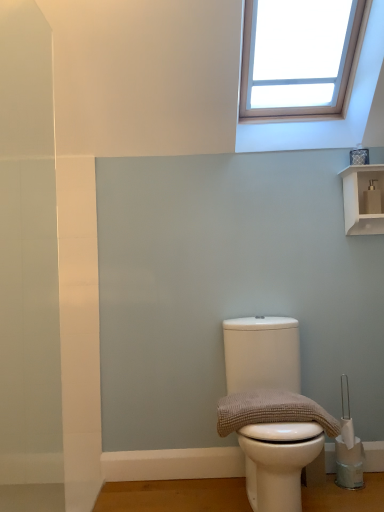
Question: Is white matte toilet at center in front of brown textured towel at center?

Choices:
 (A) no
 (B) yes

Answer: (B)

Question: Is white matte toilet at center not close to brown textured towel at center?

Choices:
 (A) no
 (B) yes

Answer: (A)

Question: From a real-world perspective, does white matte toilet at center stand above brown textured towel at center?

Choices:
 (A) no
 (B) yes

Answer: (A)

Question: Considering the relative sizes of white matte toilet at center and brown textured towel at center in the image provided, is white matte toilet at center thinner than brown textured towel at center?

Choices:
 (A) no
 (B) yes

Answer: (A)

Question: Is white matte toilet at center directly adjacent to brown textured towel at center?

Choices:
 (A) no
 (B) yes

Answer: (A)

Question: Considering the relative sizes of white matte toilet at center and brown textured towel at center in the image provided, is white matte toilet at center smaller than brown textured towel at center?

Choices:
 (A) yes
 (B) no

Answer: (B)

Question: From the image's perspective, would you say brown textured towel at center is shown under white matte toilet at center?

Choices:
 (A) no
 (B) yes

Answer: (A)

Question: Is brown textured towel at center not within white matte toilet at center?

Choices:
 (A) yes
 (B) no

Answer: (B)

Question: Does brown textured towel at center have a greater height compared to white matte toilet at center?

Choices:
 (A) no
 (B) yes

Answer: (A)

Question: Is brown textured towel at center facing away from white matte toilet at center?

Choices:
 (A) no
 (B) yes

Answer: (B)

Question: Is the surface of brown textured towel at center in direct contact with white matte toilet at center?

Choices:
 (A) yes
 (B) no

Answer: (B)

Question: Is brown textured towel at center oriented towards white matte toilet at center?

Choices:
 (A) no
 (B) yes

Answer: (B)

Question: Considering the relative sizes of white glossy shelf at upper right and brown textured towel at center in the image provided, is white glossy shelf at upper right taller than brown textured towel at center?

Choices:
 (A) no
 (B) yes

Answer: (B)